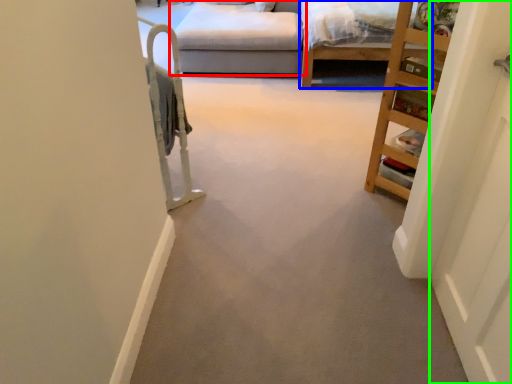
Question: Which is nearer to the studio couch (highlighted by a red box)? bed frame (highlighted by a blue box) or door (highlighted by a green box).

Choices:
 (A) bed frame
 (B) door

Answer: (A)